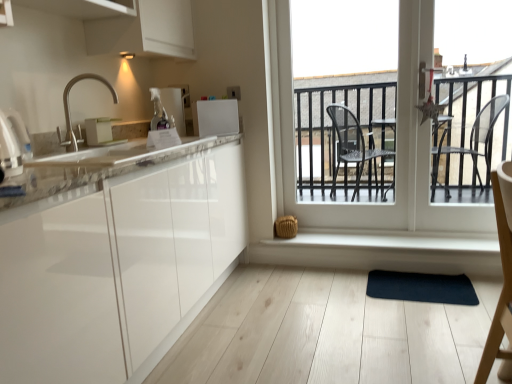
Question: From the image's perspective, would you say transparent glass door at center is shown under white glossy countertop at left?

Choices:
 (A) no
 (B) yes

Answer: (A)

Question: From a real-world perspective, is transparent glass door at center physically above white glossy countertop at left?

Choices:
 (A) yes
 (B) no

Answer: (A)

Question: Does transparent glass door at center have a larger size compared to white glossy countertop at left?

Choices:
 (A) no
 (B) yes

Answer: (B)

Question: From the image's perspective, is transparent glass door at center above white glossy countertop at left?

Choices:
 (A) yes
 (B) no

Answer: (A)

Question: Is transparent glass door at center further to the viewer compared to white glossy countertop at left?

Choices:
 (A) no
 (B) yes

Answer: (B)

Question: Looking at their shapes, would you say metallic silver toaster at upper center, which is the fourth appliance in front-to-back order, is wider or thinner than matte white toaster at upper left, placed as the 3th appliance when sorted from right to left?

Choices:
 (A) thin
 (B) wide

Answer: (B)

Question: Is metallic silver toaster at upper center, which is the third appliance in left-to-right order, taller or shorter than matte white toaster at upper left, positioned as the second appliance in left-to-right order?

Choices:
 (A) tall
 (B) short

Answer: (A)

Question: Relative to matte white toaster at upper left, which is the second appliance from front to back, is metallic silver toaster at upper center, which is the third appliance in left-to-right order, in front or behind?

Choices:
 (A) behind
 (B) front

Answer: (A)

Question: From the image's perspective, is metallic silver toaster at upper center, the 1th appliance from the back, above or below matte white toaster at upper left, placed as the 3th appliance when sorted from right to left?

Choices:
 (A) above
 (B) below

Answer: (A)

Question: Considering the positions of point (79, 139) and point (291, 114), is point (79, 139) closer or farther from the camera than point (291, 114)?

Choices:
 (A) closer
 (B) farther

Answer: (A)

Question: Relative to transparent glass door at center, is satin nickel faucet at upper left in front or behind?

Choices:
 (A) behind
 (B) front

Answer: (B)

Question: Based on their positions, is satin nickel faucet at upper left located to the left or right of transparent glass door at center?

Choices:
 (A) left
 (B) right

Answer: (A)

Question: Considering the positions of satin nickel faucet at upper left and transparent glass door at center in the image, is satin nickel faucet at upper left wider or thinner than transparent glass door at center?

Choices:
 (A) thin
 (B) wide

Answer: (B)

Question: From their relative heights in the image, would you say satin nickel faucet at upper left is taller or shorter than dark blue rubber yoga mat at center?

Choices:
 (A) tall
 (B) short

Answer: (A)

Question: Is satin nickel faucet at upper left spatially inside dark blue rubber yoga mat at center, or outside of it?

Choices:
 (A) inside
 (B) outside

Answer: (B)